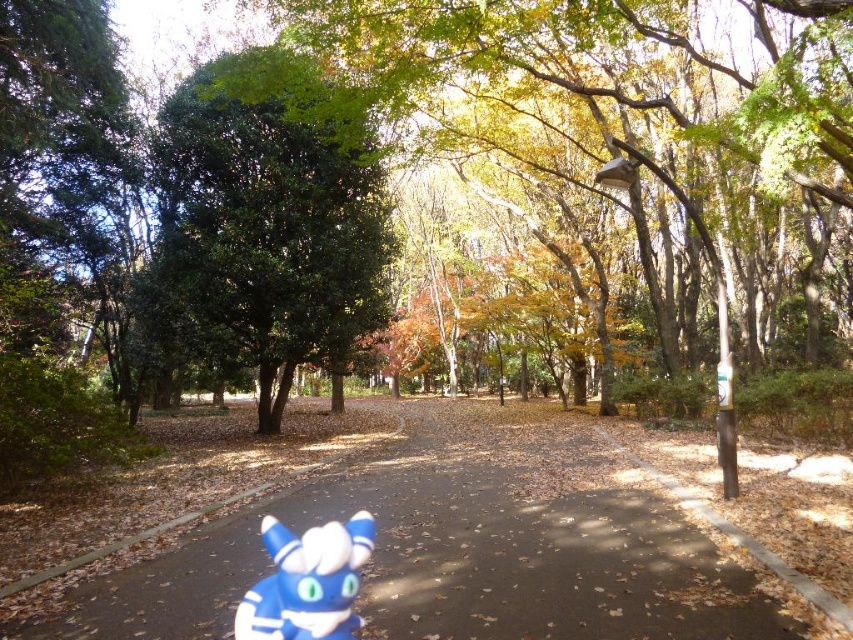
You are standing at the point marked by coordinates point [502,538] in the park. What object are you standing on?

You are standing on the brown asphalt path at center, which is located at point [502,538].

You are a child holding a blue rubber toy at center and want to walk along the brown asphalt path at center. Can you walk holding the toy without it getting stuck in the path?

The brown asphalt path at center is wider than the blue rubber toy at center, so you can walk holding the toy without it getting stuck in the path.